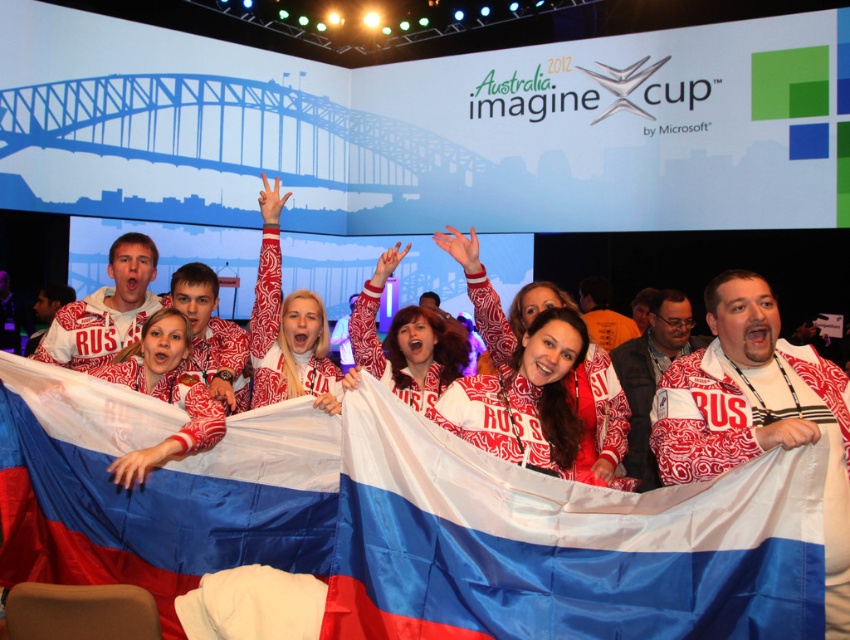
Is white matte jacket at center closer to camera compared to white textured jacket at center?

Yes, it is.

Does point (808, 381) lie behind point (208, 419)?

No, it is in front of (208, 419).

The image size is (850, 640). I want to click on white matte jacket at center, so click(757, 412).

Can you confirm if white textured jacket at center is positioned to the right of white printed sweater at center?

Indeed, white textured jacket at center is positioned on the right side of white printed sweater at center.

Between white textured jacket at center and white printed sweater at center, which one has less height?

Standing shorter between the two is white printed sweater at center.

Which is in front, point (191, 387) or point (54, 352)?

Point (191, 387) is in front.

Identify the location of white textured jacket at center. (163, 392).

Is white textured sweater at center bigger than white textured jacket at center?

Correct, white textured sweater at center is larger in size than white textured jacket at center.

Which is in front, point (258, 404) or point (131, 378)?

Positioned in front is point (131, 378).

The width and height of the screenshot is (850, 640). I want to click on white textured sweater at center, so click(x=287, y=326).